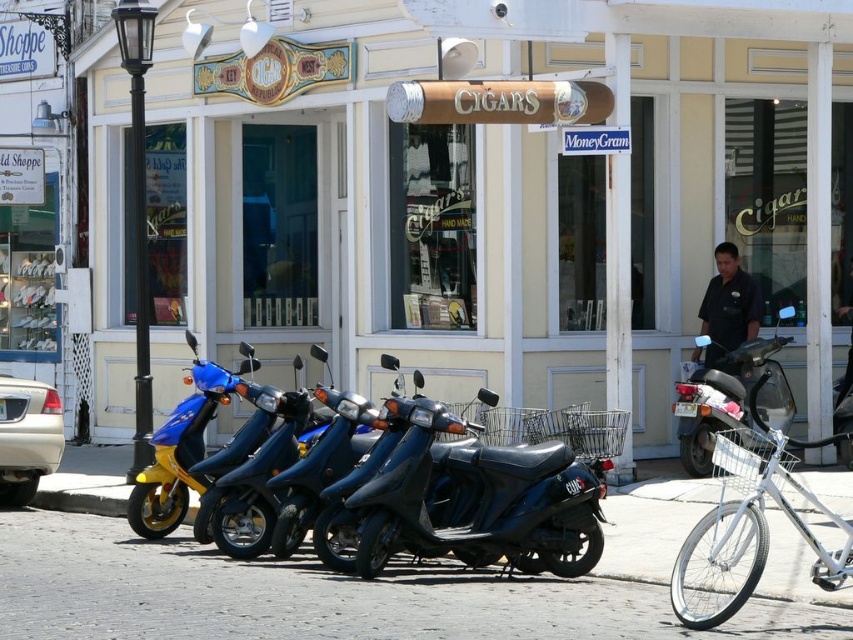
Is the position of white metallic bicycle at lower right less distant than that of metallic blue scooter at center?

Yes, it is in front of metallic blue scooter at center.

Is white metallic bicycle at lower right positioned behind metallic blue scooter at center?

No, it is in front of metallic blue scooter at center.

At what (x,y) coordinates should I click in order to perform the action: click on white metallic bicycle at lower right. Please return your answer as a coordinate pair (x, y). Image resolution: width=853 pixels, height=640 pixels. Looking at the image, I should click on (755, 516).

Who is positioned more to the right, cobblestone pavement at center or white metallic bicycle at lower right?

white metallic bicycle at lower right

Does cobblestone pavement at center have a lesser width compared to white metallic bicycle at lower right?

Yes, cobblestone pavement at center is thinner than white metallic bicycle at lower right.

In order to click on cobblestone pavement at center in this screenshot , I will do `click(321, 596)`.

Is shiny black scooter at center shorter than white metallic bicycle at lower right?

No.

Between shiny black scooter at center and white metallic bicycle at lower right, which one appears on the left side from the viewer's perspective?

Positioned to the left is shiny black scooter at center.

Does point (398, 480) lie behind point (749, 400)?

No.

At what (x,y) coordinates should I click in order to perform the action: click on shiny black scooter at center. Please return your answer as a coordinate pair (x, y). Looking at the image, I should click on pyautogui.click(x=477, y=499).